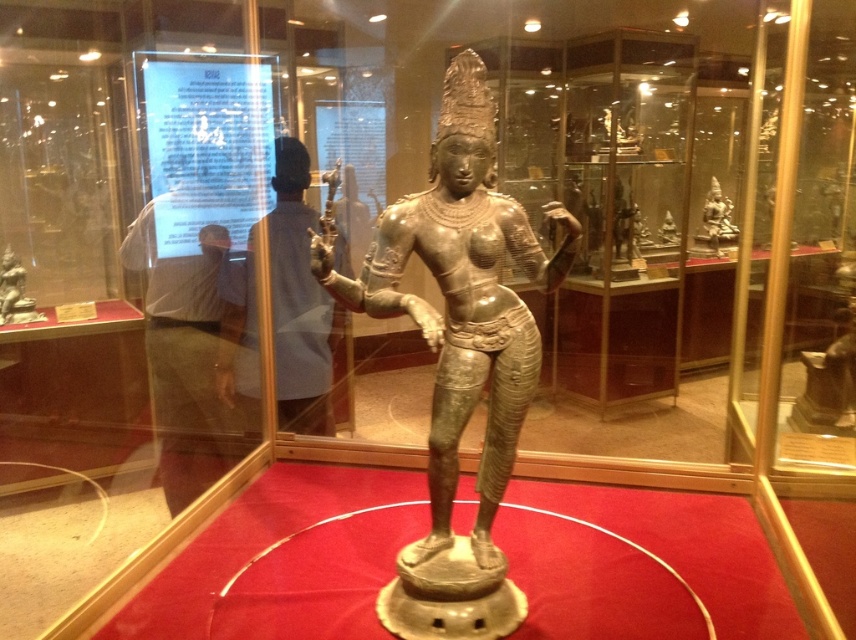
Question: Can you confirm if shiny bronze statue at center is wider than bronze statue at left?

Choices:
 (A) no
 (B) yes

Answer: (B)

Question: Estimate the real-world distances between objects in this image. Which object is farther from the bronze statue at left?

Choices:
 (A) matte gray statue at center
 (B) bronze statue at upper right
 (C) blue fabric shirt at upper center
 (D) shiny bronze statue at center

Answer: (B)

Question: Which object is farther from the camera taking this photo?

Choices:
 (A) bronze statue at upper right
 (B) shiny bronze statue at center
 (C) matte gray statue at center

Answer: (A)

Question: Which of these objects is positioned farthest from the bronze statue at upper right?

Choices:
 (A) bronze statue at left
 (B) matte gray statue at center

Answer: (A)

Question: Is shiny bronze statue at center wider than bronze statue at upper right?

Choices:
 (A) no
 (B) yes

Answer: (B)

Question: Can you confirm if shiny bronze statue at center is positioned to the left of matte gray statue at center?

Choices:
 (A) no
 (B) yes

Answer: (A)